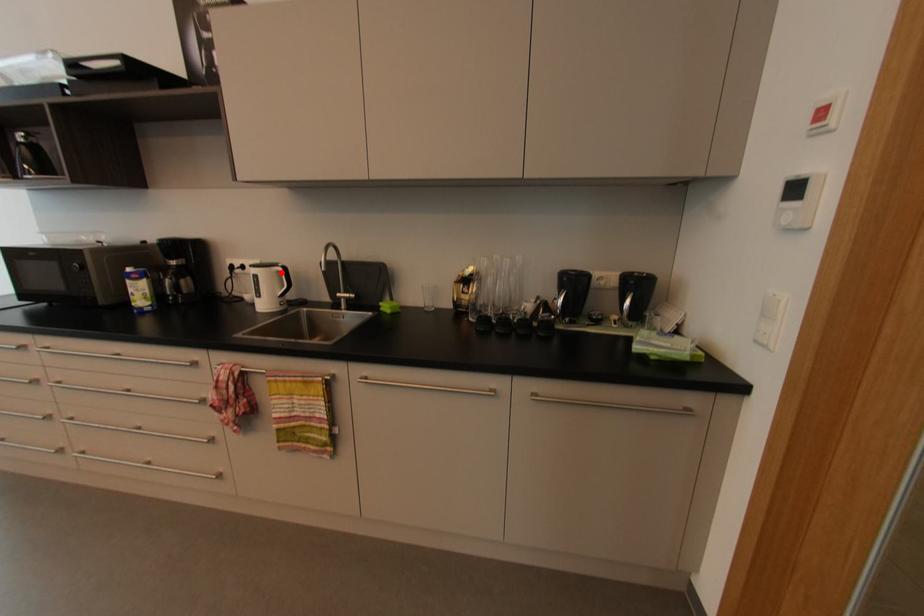
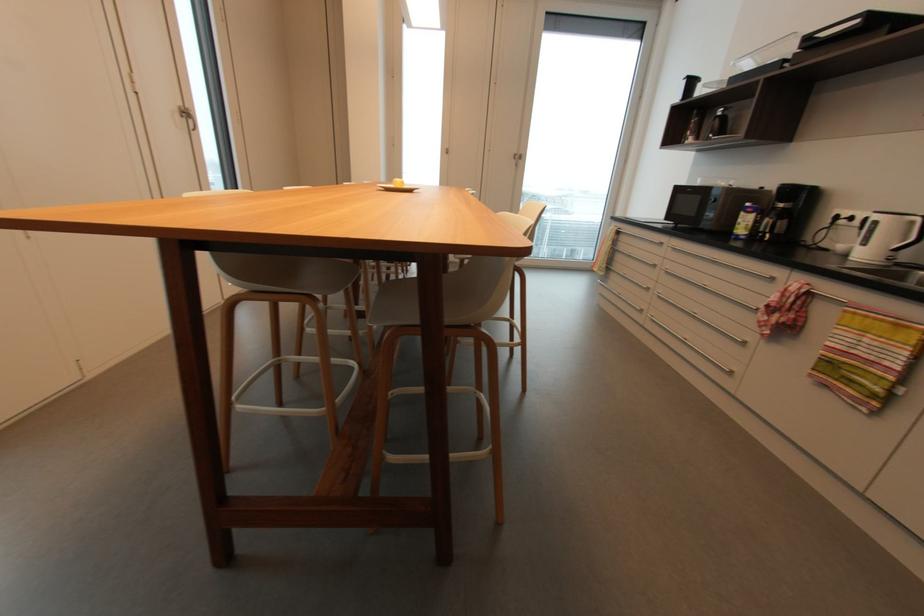
Locate, in the second image, the point that corresponds to the highlighted location in the first image.

(916, 223)